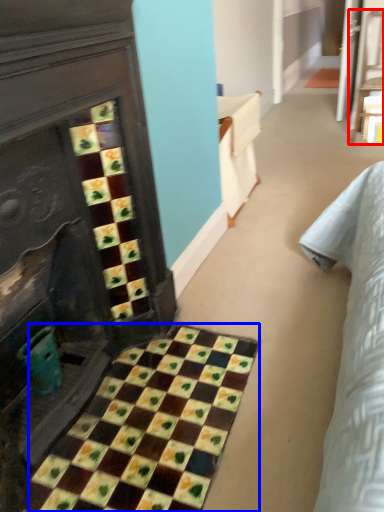
Question: Which of the following is the farthest to the observer, furniture (highlighted by a red box) or ceramic tile (highlighted by a blue box)?

Choices:
 (A) furniture
 (B) ceramic tile

Answer: (A)